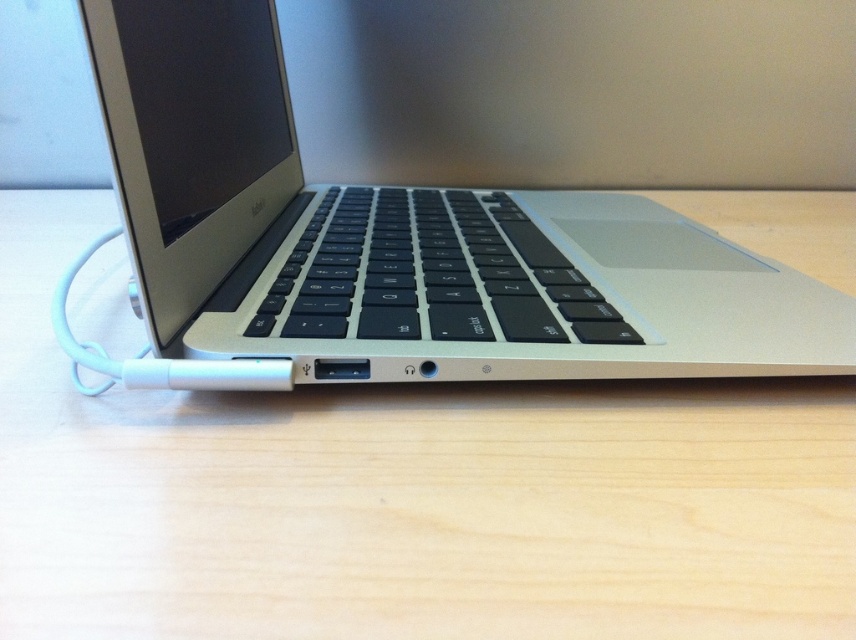
You are a photographer setting up a shot of the silver laptop. You need to place a small prop exactly at the point marked as point (405,496). Where on the light wood table at center should you place the prop?

The point (405,496) corresponds to the light wood table at center, so you should place the prop on the light wood table at center.

You are setting up a workspace and need to place a laptop and a table. Based on the image, which object should you place first if you want the silver metallic laptop at center to be positioned to the right of the light wood table at center?

The light wood table at center should be placed first because the silver metallic laptop at center is positioned to the right of it, so placing the table first allows the laptop to be placed accordingly.